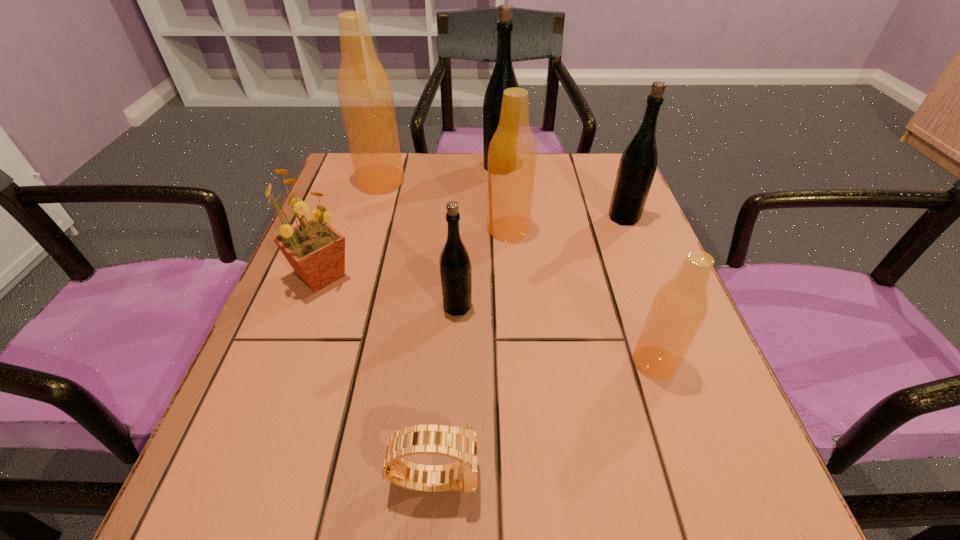
You are a GUI agent. You are given a task and a screenshot of the screen. Output one action in this format:
    pyautogui.click(x=<x>, y=<y>)
    Task: Click on the second green beer bottle from left to right
    
    Given the screenshot: What is the action you would take?
    pyautogui.click(x=503, y=76)

This screenshot has width=960, height=540. In order to click on the farthest green beer bottle in this screenshot , I will do `click(503, 76)`.

Find the location of a particular element. the leftmost beer bottle is located at coordinates (364, 90).

Locate an element on the screen. the biggest tan beer bottle is located at coordinates (364, 90).

The width and height of the screenshot is (960, 540). I want to click on the second farthest green beer bottle, so [638, 163].

Identify the location of the rightmost green beer bottle. (638, 163).

Where is `the second tan beer bottle from left to right`? This screenshot has height=540, width=960. the second tan beer bottle from left to right is located at coordinates (512, 155).

The width and height of the screenshot is (960, 540). Find the location of `the second smallest tan beer bottle`. the second smallest tan beer bottle is located at coordinates (512, 155).

At what (x,y) coordinates should I click in order to perform the action: click on sunflower. Please return your answer as a coordinate pair (x, y). The width and height of the screenshot is (960, 540). Looking at the image, I should click on click(316, 251).

The height and width of the screenshot is (540, 960). I want to click on the nearest green beer bottle, so pos(455,267).